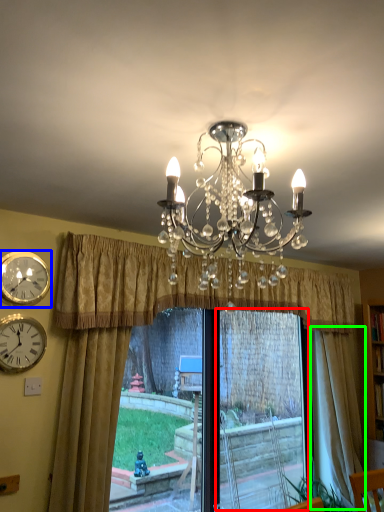
Question: Based on their relative distances, which object is farther from window frame (highlighted by a red box)? Choose from wall clock (highlighted by a blue box) and curtain (highlighted by a green box).

Choices:
 (A) wall clock
 (B) curtain

Answer: (A)